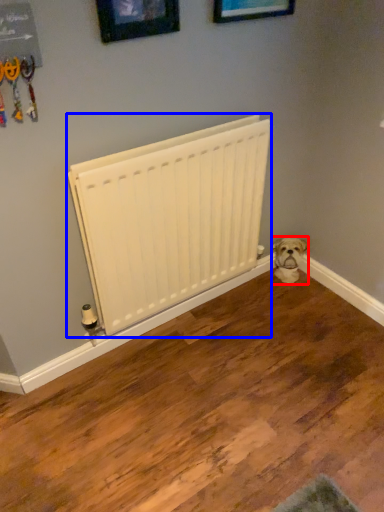
Question: Which object is closer to the camera taking this photo, dog (highlighted by a red box) or radiator (highlighted by a blue box)?

Choices:
 (A) dog
 (B) radiator

Answer: (B)